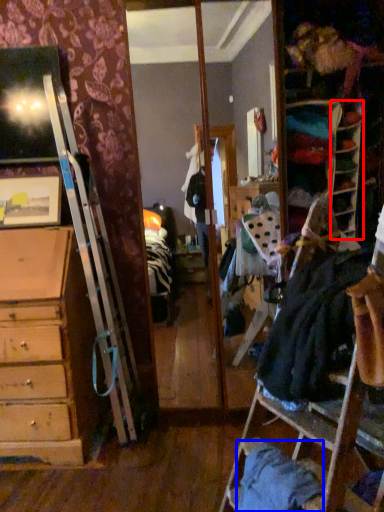
Question: Which point is further to the camera, shelf (highlighted by a red box) or clothing (highlighted by a blue box)?

Choices:
 (A) shelf
 (B) clothing

Answer: (A)